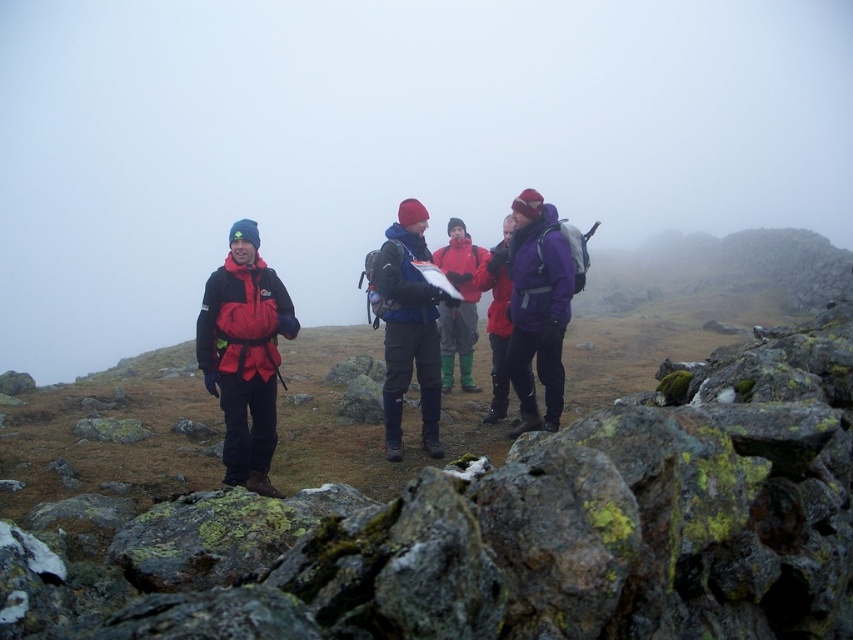
Question: Does rough textured rock at lower left have a greater width compared to red waterproof jacket at center?

Choices:
 (A) yes
 (B) no

Answer: (A)

Question: Which object is the closest to the purple softshell jacket at center?

Choices:
 (A) rough textured rock at lower left
 (B) red waterproof jacket at center
 (C) matte blue jacket at center

Answer: (C)

Question: Is red waterproof jacket at center wider than purple softshell jacket at center?

Choices:
 (A) no
 (B) yes

Answer: (B)

Question: Among these points, which one is farthest from the camera?

Choices:
 (A) (544, 232)
 (B) (473, 268)

Answer: (B)

Question: Which object is the closest to the purple fleece jacket at center?

Choices:
 (A) purple softshell jacket at center
 (B) rough textured rock at lower left
 (C) matte blue jacket at center

Answer: (C)

Question: Is purple fleece jacket at center positioned before red waterproof jacket at center?

Choices:
 (A) yes
 (B) no

Answer: (A)